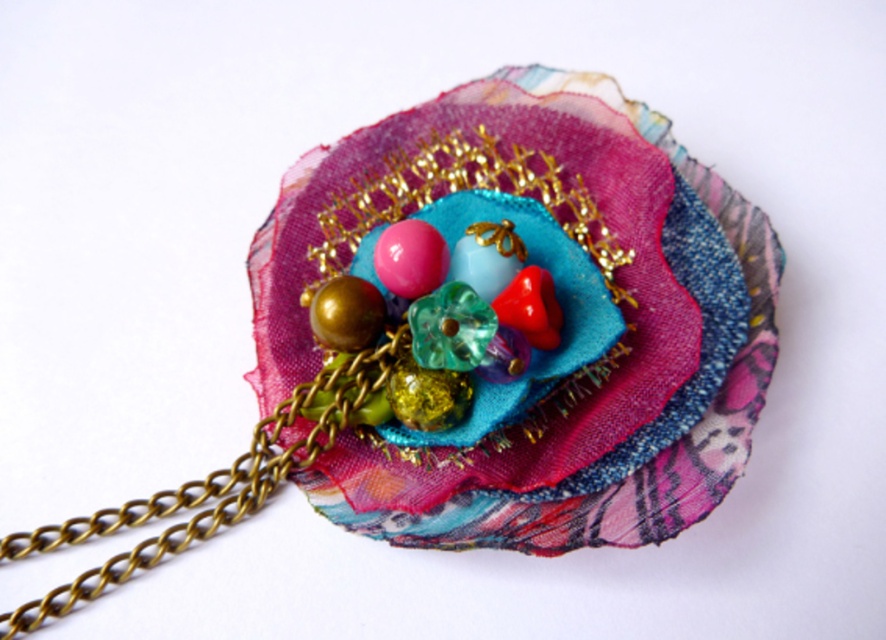
You are an artisan working on a delicate jewelry piece. You have a textile flower at center and a translucent green glass bead at center. You need to know if the distance between them is sufficient to avoid tangling when worn. Can you confirm if the distance is at least 20 centimeters?

The distance between the textile flower at center and the translucent green glass bead at center is 23.66 centimeters, which is more than the required 20 centimeters. Therefore, the distance is sufficient to avoid tangling when worn.